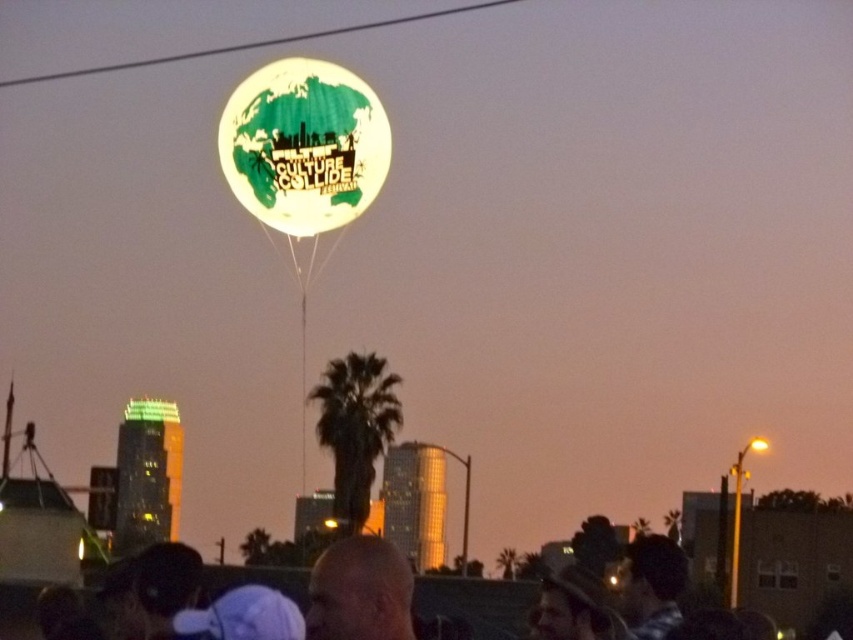
You are standing in the twilight scene and notice the translucent white balloon at center and the bald head at upper center. Which object is positioned higher in the sky?

The translucent white balloon at center is positioned higher in the sky than the bald head at upper center.

You are a photographer trying to capture the bald head at upper center and the green matte balloon at upper center in the same frame. Based on their sizes, which one will appear bigger in your photo?

The bald head at upper center will appear bigger in the photo since it has a larger size compared to the green matte balloon at upper center.

You are a photographer trying to capture the balloon and the palm tree in the same frame. The point at coordinates point (360, 592) is on the bald head at upper center. Where should you position yourself relative to the palm tree and the balloon to ensure both are visible in your shot?

To include both the balloon and the palm tree in your photo, position yourself so that the point at coordinates point (360, 592) on the bald head at upper center is aligned with the palm tree and the balloon, ensuring they are within your camera frame.